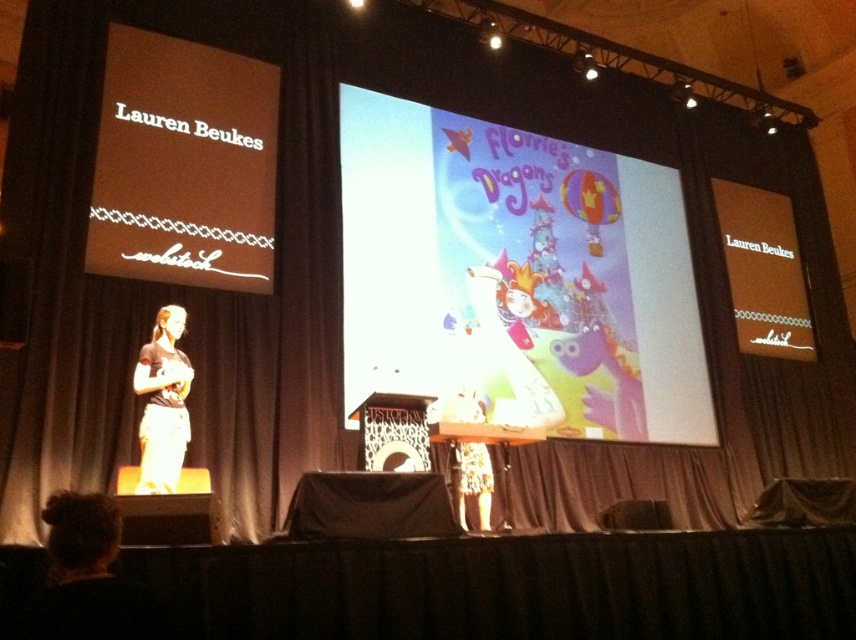
Can you confirm if white cotton pants at lower left is positioned below white textured dress at center?

Incorrect, white cotton pants at lower left is not positioned below white textured dress at center.

Image resolution: width=856 pixels, height=640 pixels. I want to click on white cotton pants at lower left, so click(162, 403).

Where is `white cotton pants at lower left`? This screenshot has height=640, width=856. white cotton pants at lower left is located at coordinates (162, 403).

Does cartoonish paper-like poster at center have a lesser height compared to white cotton pants at lower left?

In fact, cartoonish paper-like poster at center may be taller than white cotton pants at lower left.

Is cartoonish paper-like poster at center thinner than white cotton pants at lower left?

No, cartoonish paper-like poster at center is not thinner than white cotton pants at lower left.

This screenshot has width=856, height=640. Identify the location of cartoonish paper-like poster at center. (516, 275).

Where is `cartoonish paper-like poster at center`? Image resolution: width=856 pixels, height=640 pixels. cartoonish paper-like poster at center is located at coordinates (516, 275).

Who is more forward, (412, 234) or (482, 445)?

Point (482, 445) is more forward.

This screenshot has height=640, width=856. Describe the element at coordinates (516, 275) in the screenshot. I see `cartoonish paper-like poster at center` at that location.

Between point (372, 349) and point (459, 410), which one is positioned in front?

Point (459, 410)

At what (x,y) coordinates should I click in order to perform the action: click on cartoonish paper-like poster at center. Please return your answer as a coordinate pair (x, y). Looking at the image, I should click on (516, 275).